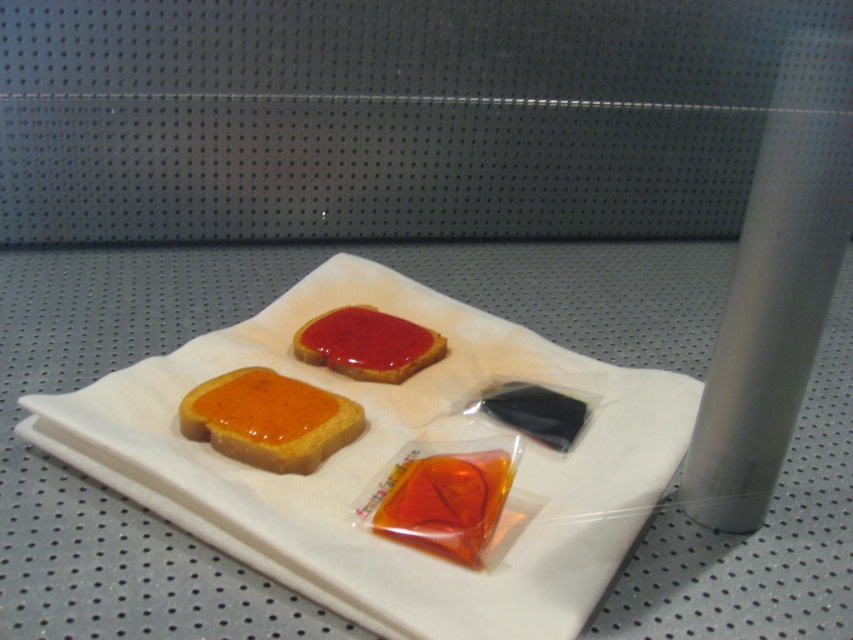
Looking at this image, is matte orange toast at center taller than matte red toast at center?

Incorrect, matte orange toast at center's height is not larger of matte red toast at center's.

Is matte orange toast at center above matte red toast at center?

No, matte orange toast at center is not above matte red toast at center.

Is point (254, 394) positioned behind point (380, 356)?

No, (254, 394) is closer to viewer.

Locate an element on the screen. This screenshot has width=853, height=640. matte orange toast at center is located at coordinates (270, 419).

Does matte orange toast at center appear over translucent orange gel at center?

Yes.

Locate an element on the screen. The height and width of the screenshot is (640, 853). matte orange toast at center is located at coordinates (270, 419).

Between point (256, 428) and point (444, 474), which one is positioned in front?

Point (444, 474)

Find the location of a particular element. Image resolution: width=853 pixels, height=640 pixels. matte orange toast at center is located at coordinates (270, 419).

What do you see at coordinates (444, 502) in the screenshot? Image resolution: width=853 pixels, height=640 pixels. I see `translucent orange gel at center` at bounding box center [444, 502].

Does translucent orange gel at center come in front of matte red toast at center?

Yes.

Locate an element on the screen. The image size is (853, 640). translucent orange gel at center is located at coordinates (444, 502).